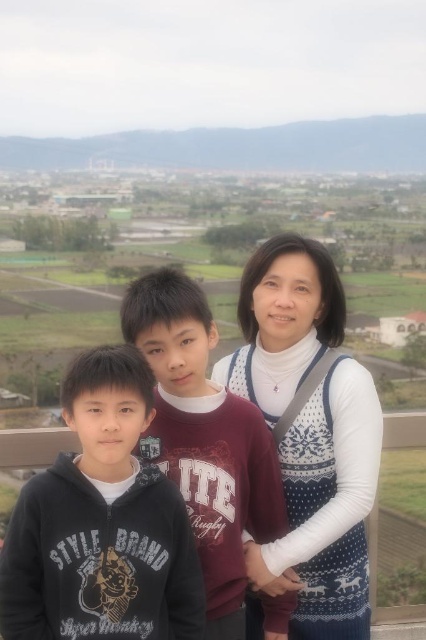
Question: Is white sweater at center to the right of black matte hoodie at left from the viewer's perspective?

Choices:
 (A) no
 (B) yes

Answer: (B)

Question: Does white sweater at center have a smaller size compared to black matte hoodie at left?

Choices:
 (A) no
 (B) yes

Answer: (A)

Question: Which point is farther to the camera?

Choices:
 (A) matte black hoodie at center
 (B) black matte hoodie at left
 (C) white knitted sweater at center

Answer: (C)

Question: Considering the real-world distances, which object is closest to the white knitted sweater at center?

Choices:
 (A) white sweater at center
 (B) black matte hoodie at left

Answer: (A)

Question: From the image, what is the correct spatial relationship of white sweater at center in relation to matte black hoodie at center?

Choices:
 (A) above
 (B) below

Answer: (A)

Question: Among these points, which one is farthest from the camera?

Choices:
 (A) (342, 548)
 (B) (138, 323)
 (C) (146, 440)

Answer: (A)